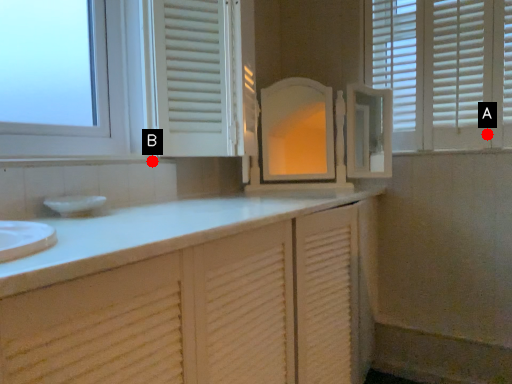
Question: Two points are circled on the image, labeled by A and B beside each circle. Which point appears farthest from the camera in this image?

Choices:
 (A) A is further
 (B) B is further

Answer: (A)